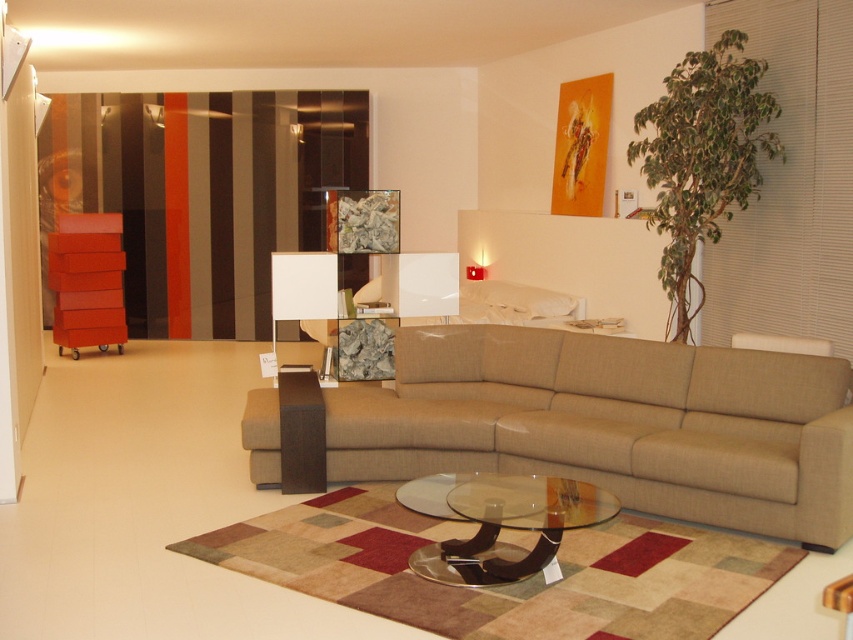
Question: Is beige fabric couch at center in front of transparent glass coffee table at center?

Choices:
 (A) no
 (B) yes

Answer: (A)

Question: Can you confirm if beige fabric couch at center is wider than transparent glass coffee table at center?

Choices:
 (A) no
 (B) yes

Answer: (B)

Question: Can you confirm if beige fabric couch at center is thinner than transparent glass coffee table at center?

Choices:
 (A) no
 (B) yes

Answer: (A)

Question: Which point is closer to the camera?

Choices:
 (A) (570, 516)
 (B) (722, 365)

Answer: (A)